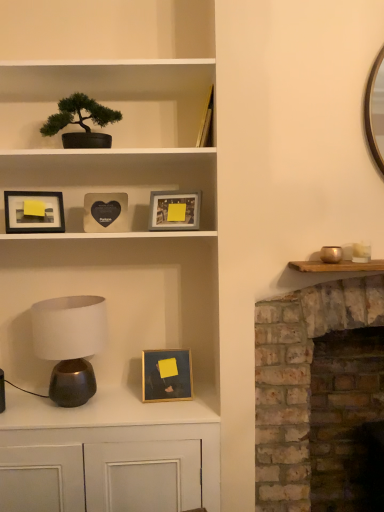
I want to click on blank space situated above matte black cabinet at center (from a real-world perspective), so click(x=86, y=407).